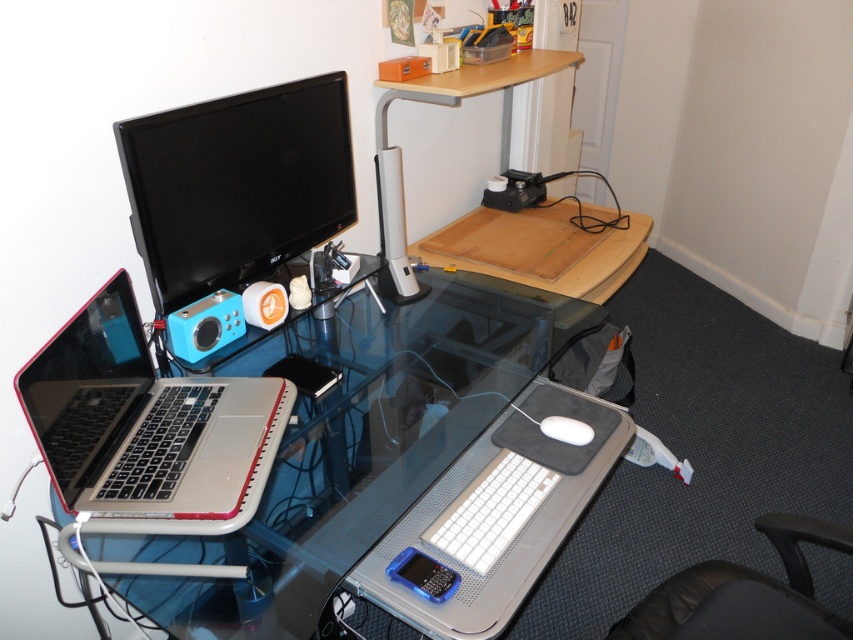
Question: Which point is closer to the camera?

Choices:
 (A) (160, 264)
 (B) (505, 532)
 (C) (567, 428)
 (D) (393, 276)

Answer: (B)

Question: Which point is closer to the camera?

Choices:
 (A) silver metallic laptop at left
 (B) white plastic keyboard at center
 (C) black glossy monitor at upper left

Answer: (A)

Question: Does black leather swivel chair at lower right come in front of white matte mouse at center?

Choices:
 (A) yes
 (B) no

Answer: (A)

Question: Does transparent glass table at center appear on the right side of black glossy monitor at upper left?

Choices:
 (A) yes
 (B) no

Answer: (A)

Question: Can you confirm if black glossy monitor at upper left is positioned above white plastic keyboard at center?

Choices:
 (A) yes
 (B) no

Answer: (A)

Question: Which point is closer to the camera?

Choices:
 (A) white plastic speaker at center
 (B) transparent glass table at center
 (C) white matte mouse at center

Answer: (B)